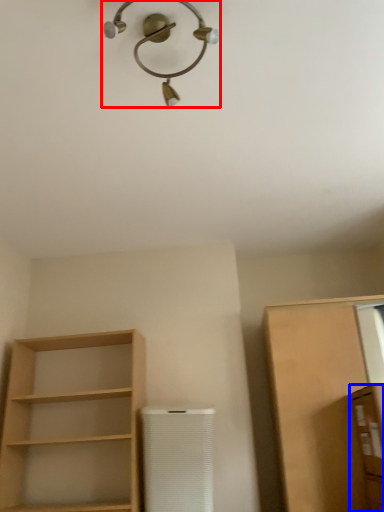
Question: Which of the following is the closest to the observer, light fixture (highlighted by a red box) or cabinetry (highlighted by a blue box)?

Choices:
 (A) light fixture
 (B) cabinetry

Answer: (A)